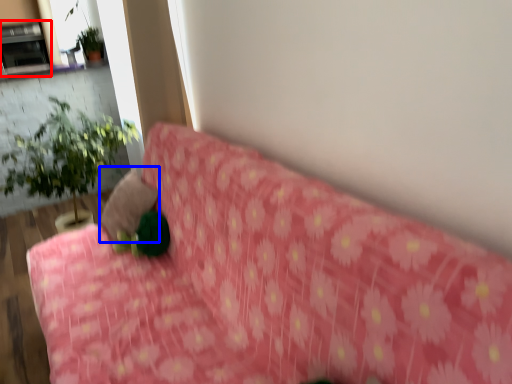
Question: Which of the following is the farthest to the observer, fireplace (highlighted by a red box) or pillow (highlighted by a blue box)?

Choices:
 (A) fireplace
 (B) pillow

Answer: (A)